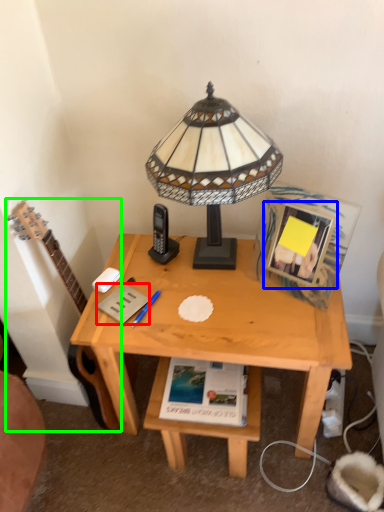
Question: Based on their relative distances, which object is farther from paperback book (highlighted by a red box)? Choose from picture frame (highlighted by a blue box) and guitar (highlighted by a green box).

Choices:
 (A) picture frame
 (B) guitar

Answer: (A)